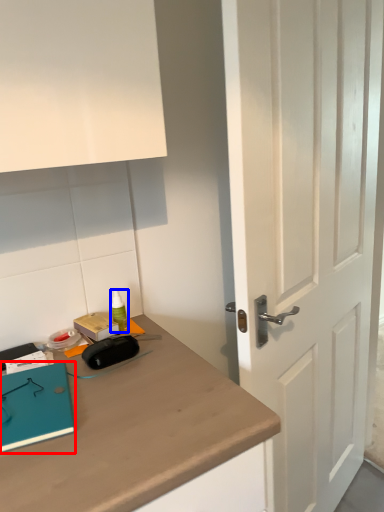
Question: Among these objects, which one is farthest to the camera, notebook (highlighted by a red box) or stationery (highlighted by a blue box)?

Choices:
 (A) notebook
 (B) stationery

Answer: (B)